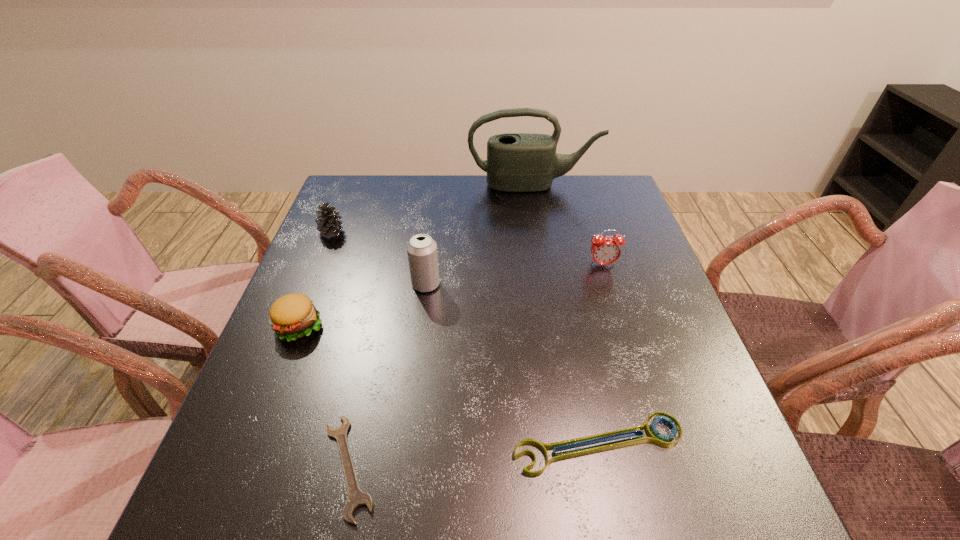
Where is `the farthest object`? This screenshot has width=960, height=540. the farthest object is located at coordinates (516, 162).

Where is `the tallest object`? Image resolution: width=960 pixels, height=540 pixels. the tallest object is located at coordinates (516, 162).

The height and width of the screenshot is (540, 960). I want to click on the fourth farthest object, so click(x=422, y=254).

Locate an element on the screen. the second tallest object is located at coordinates (422, 254).

You are a GUI agent. You are given a task and a screenshot of the screen. Output one action in this format:
    pyautogui.click(x=<x>, y=<y>)
    Task: Click on the third farthest object
    The height and width of the screenshot is (540, 960).
    Given the screenshot: What is the action you would take?
    pyautogui.click(x=605, y=250)

Identify the location of the fourth tallest object. (328, 225).

This screenshot has width=960, height=540. I want to click on the second farthest object, so click(328, 225).

Find the location of a particular element. The height and width of the screenshot is (540, 960). the fifth tallest object is located at coordinates (292, 316).

At what (x,y) coordinates should I click in order to perform the action: click on hamburger. Please return your answer as a coordinate pair (x, y). This screenshot has height=540, width=960. Looking at the image, I should click on (292, 316).

I want to click on the right wrench, so click(654, 436).